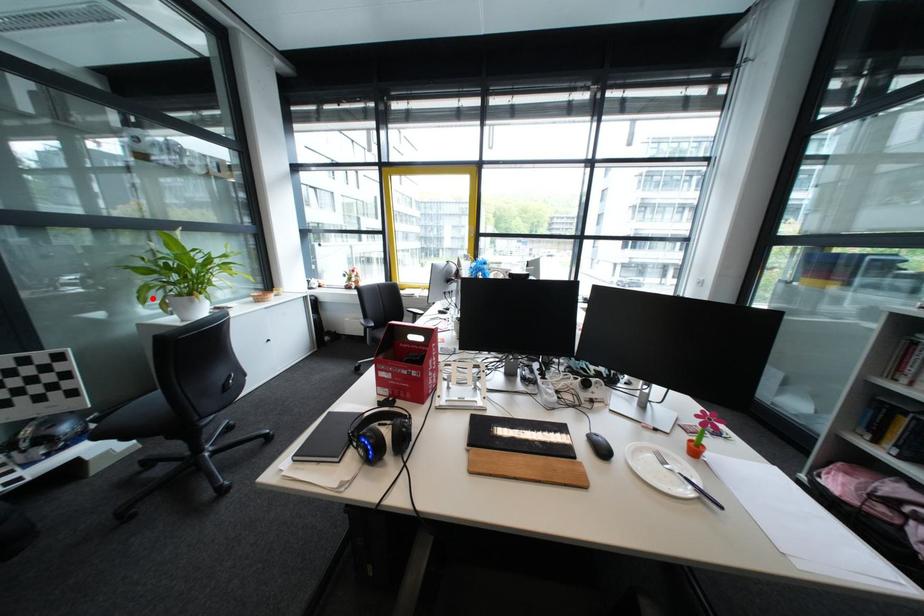
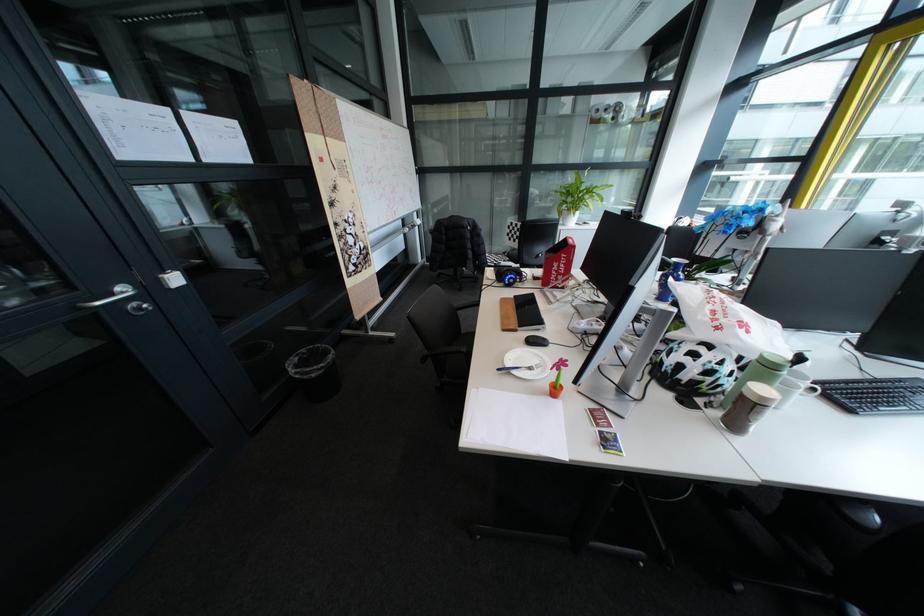
Question: I am providing you with two images of the same scene from different viewpoints. In image1, a red point is highlighted. Considering the same 3D point in image2, which of the following is correct?

Choices:
 (A) It is closer
 (B) It is farther

Answer: (A)